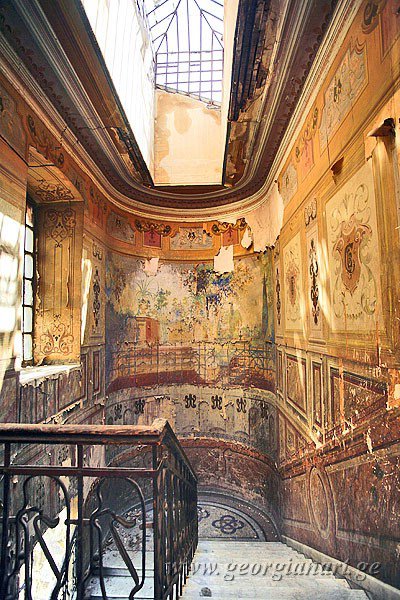
Locate an element on the screen. This screenshot has width=400, height=600. wall to the right of the stairs is located at coordinates (360, 398).